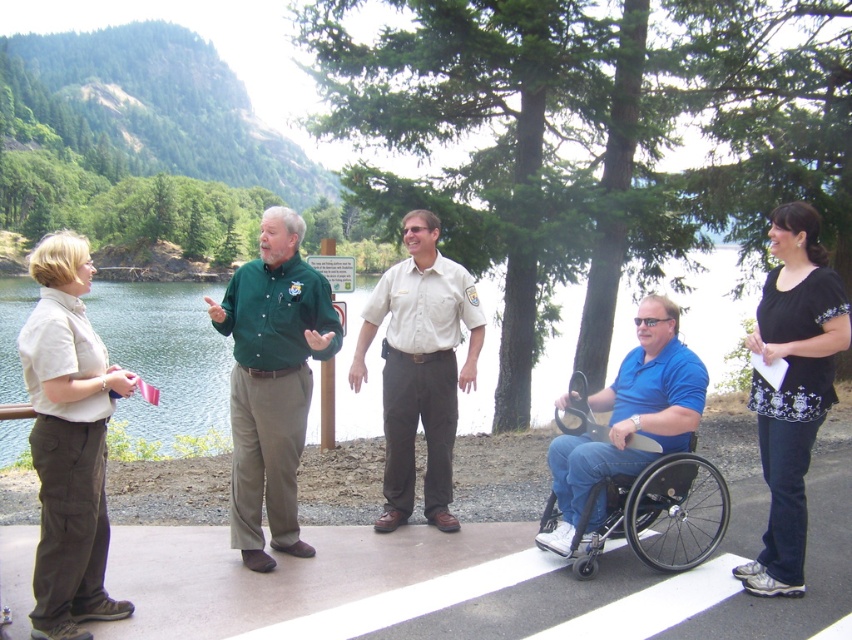
Question: Is green shirt at center wider than beige uniform shirt at center?

Choices:
 (A) yes
 (B) no

Answer: (A)

Question: Is clear water at left bigger than black plastic wheelchair at center?

Choices:
 (A) yes
 (B) no

Answer: (A)

Question: Which point is farther to the camera?

Choices:
 (A) (279, 538)
 (B) (795, 298)
 (C) (628, 483)

Answer: (A)

Question: Among these objects, which one is farthest from the camera?

Choices:
 (A) clear water at left
 (B) green shirt at center
 (C) black plastic wheelchair at center

Answer: (C)

Question: Estimate the real-world distances between objects in this image. Which object is farther from the clear water at left?

Choices:
 (A) green shirt at center
 (B) black plastic wheelchair at center

Answer: (A)

Question: In this image, where is clear water at left located relative to beige uniform shirt at center?

Choices:
 (A) right
 (B) left

Answer: (B)